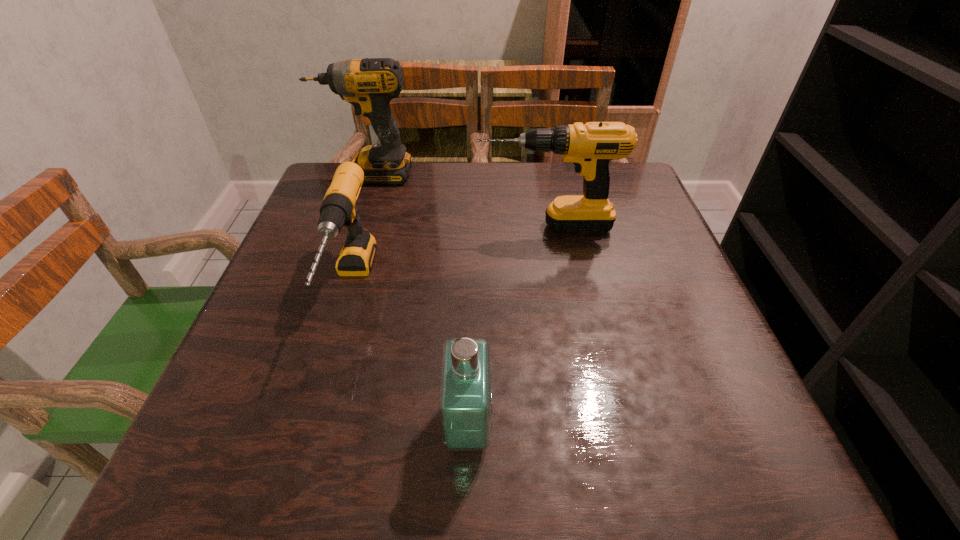
You are a GUI agent. You are given a task and a screenshot of the screen. Output one action in this format:
    pyautogui.click(x=<x>, y=<y>)
    Task: Click on the free area in between the shortest drill and the rightmost drill
    The height and width of the screenshot is (540, 960).
    Given the screenshot: What is the action you would take?
    pyautogui.click(x=448, y=255)

Choose which object is the second nearest neighbor to the perfume. Please provide its 2D coordinates. Your answer should be formatted as a tuple, i.e. [(x, y)], where the tuple contains the x and y coordinates of a point satisfying the conditions above.

[(590, 146)]

Identify which object is the third nearest to the farthest drill. Please provide its 2D coordinates. Your answer should be formatted as a tuple, i.e. [(x, y)], where the tuple contains the x and y coordinates of a point satisfying the conditions above.

[(465, 392)]

Choose which drill is the third nearest neighbor to the nearest object. Please provide its 2D coordinates. Your answer should be formatted as a tuple, i.e. [(x, y)], where the tuple contains the x and y coordinates of a point satisfying the conditions above.

[(369, 85)]

The width and height of the screenshot is (960, 540). What are the coordinates of `drill that is the closest one to the third shortest object` in the screenshot? It's located at tap(338, 208).

I want to click on free location that satisfies the following two spatial constraints: 1. at the tip of the second tallest drill; 2. on the handle side of the shortest drill, so click(x=556, y=284).

Identify the location of vacant space that satisfies the following two spatial constraints: 1. at the tip of the second tallest drill; 2. on the handle side of the shortest drill. This screenshot has width=960, height=540. (556, 284).

What are the coordinates of `free point that satisfies the following two spatial constraints: 1. at the tip of the rightmost drill; 2. on the handle side of the shortest drill` in the screenshot? It's located at (556, 284).